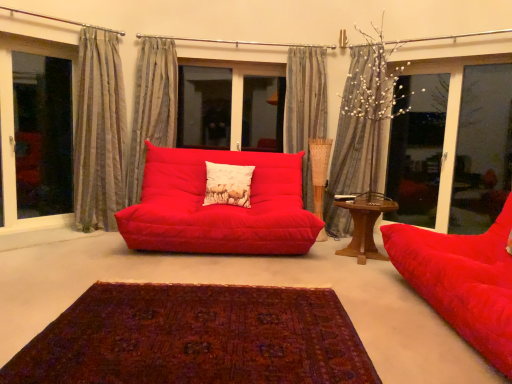
The height and width of the screenshot is (384, 512). Identify the location of free space behind deep burgundy woven rug at center. (228, 261).